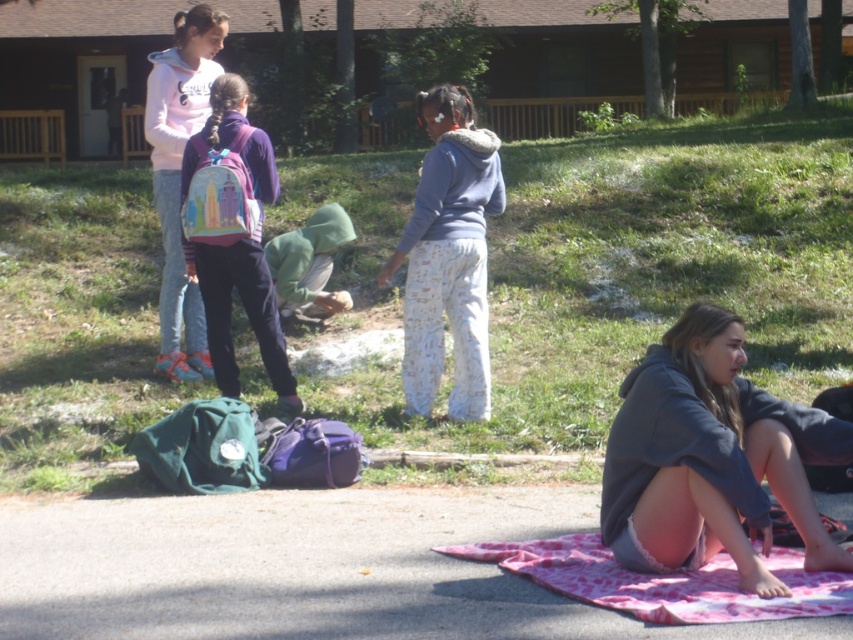
Question: From the image, what is the correct spatial relationship of green grass at center in relation to matte pink backpack at upper left?

Choices:
 (A) left
 (B) right

Answer: (B)

Question: Is dark gray hoodie at lower right further to the viewer compared to pastel pink backpack at center-left?

Choices:
 (A) no
 (B) yes

Answer: (A)

Question: Does pastel pink backpack at center-left appear over green fuzzy hoodie at center?

Choices:
 (A) no
 (B) yes

Answer: (A)

Question: Based on their relative distances, which object is nearer to the pink fabric blanket at lower right?

Choices:
 (A) pastel pink backpack at center-left
 (B) dark gray hoodie at lower right
 (C) gray fleece hoodie at center
 (D) matte pink backpack at upper left

Answer: (B)

Question: Which object is farther from the camera taking this photo?

Choices:
 (A) pink fabric blanket at lower right
 (B) green grass at center
 (C) gray fleece hoodie at center

Answer: (C)

Question: Which object is positioned farthest from the matte pink backpack at upper left?

Choices:
 (A) green fuzzy hoodie at center
 (B) green grass at center

Answer: (B)